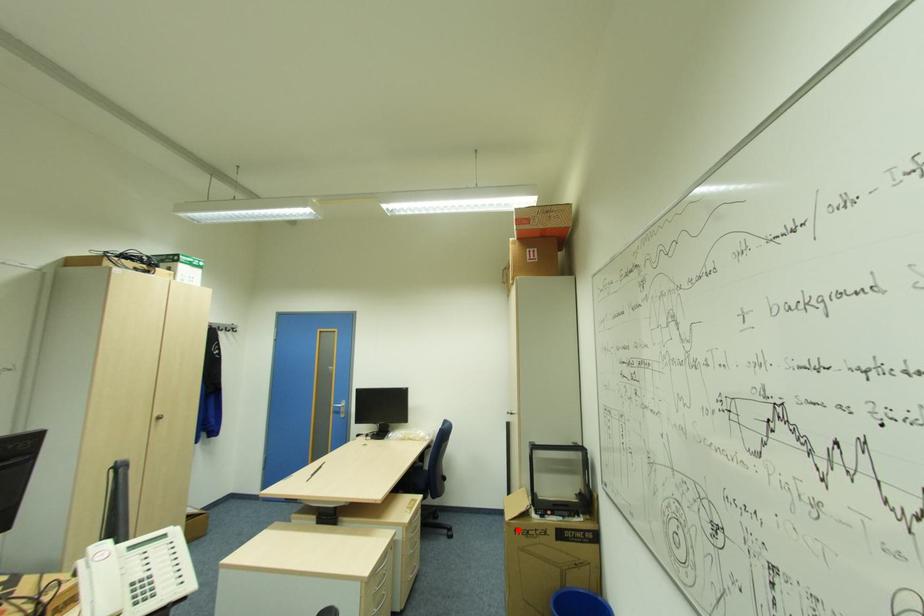
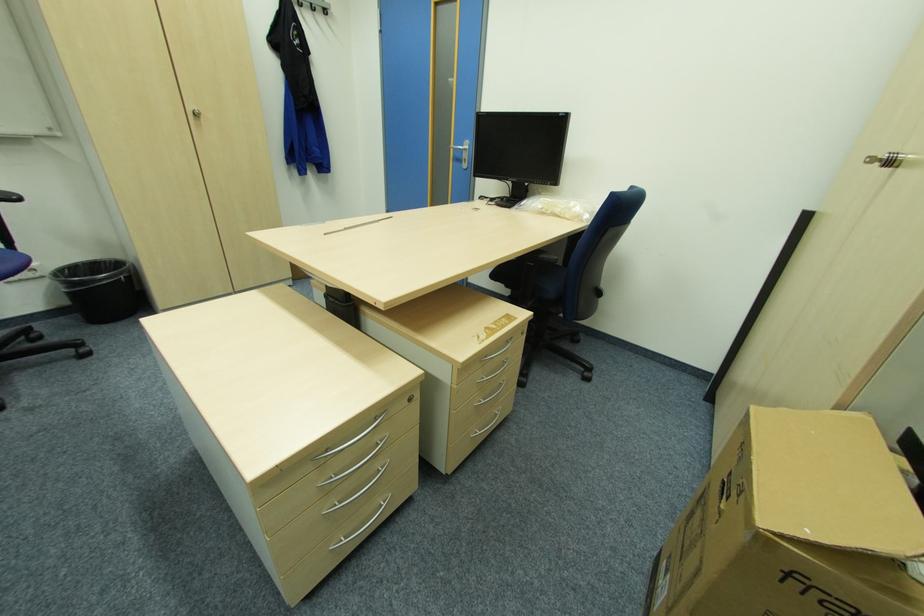
Question: I am providing you with two images of the same scene from different viewpoints. Image1 has a red point marked. In image2, the corresponding 3D location appears at what relative position? Reply with the corresponding letter.

Choices:
 (A) Closer
 (B) Farther

Answer: (A)